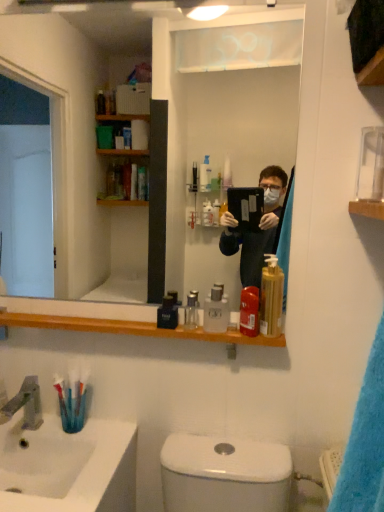
I want to click on vacant region to the right of translucent plastic toothbrush at lower left, so coord(110,430).